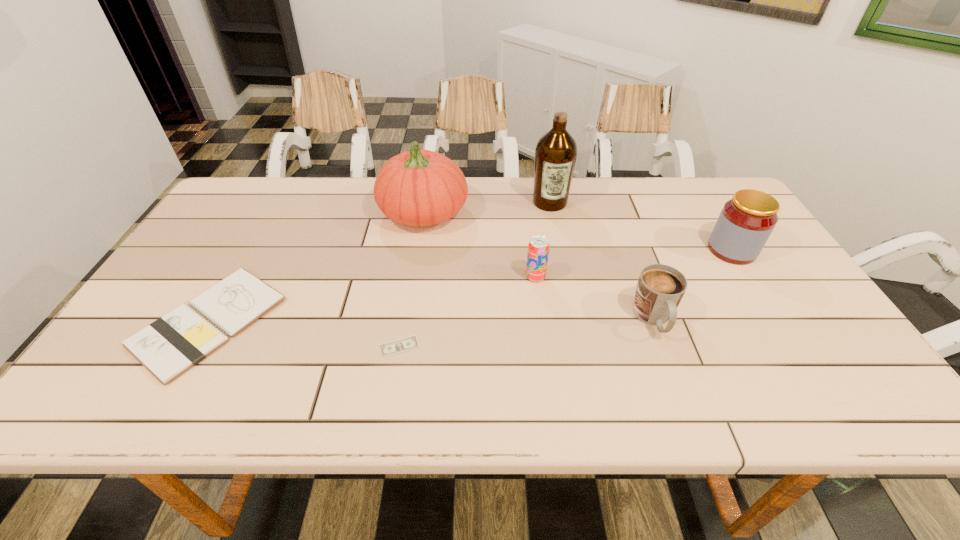
Find the location of a particular element. free space located on the left of the pumpkin is located at coordinates pyautogui.click(x=324, y=213).

In order to click on vacant space positioned on the front of the rightmost object in this screenshot , I will do `click(788, 340)`.

Where is `vacant space located 0.270m on the left of the soda can`? The image size is (960, 540). vacant space located 0.270m on the left of the soda can is located at coordinates (421, 276).

I want to click on vacant space situated 0.150m on the side of the sixth object from left to right with the handle, so click(x=685, y=404).

Where is `vacant space situated on the front of the second shortest object`? vacant space situated on the front of the second shortest object is located at coordinates (157, 413).

The width and height of the screenshot is (960, 540). In order to click on vacant space located on the right of the money in this screenshot , I will do `click(537, 346)`.

Locate an element on the screen. The image size is (960, 540). olive oil at the far edge is located at coordinates (556, 152).

I want to click on pumpkin at the far edge, so click(422, 188).

The image size is (960, 540). I want to click on object at the near edge, so click(x=169, y=346).

At what (x,y) coordinates should I click in order to perform the action: click on object positioned at the left edge. Please return your answer as a coordinate pair (x, y). Looking at the image, I should click on (169, 346).